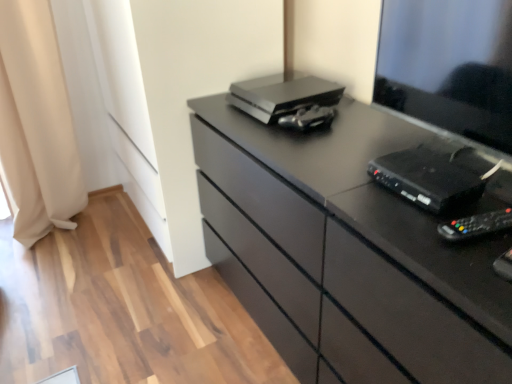
Locate an element on the screen. The width and height of the screenshot is (512, 384). free space to the back side of black plastic remote control at right, the 3th equipment viewed from the top is located at coordinates (462, 198).